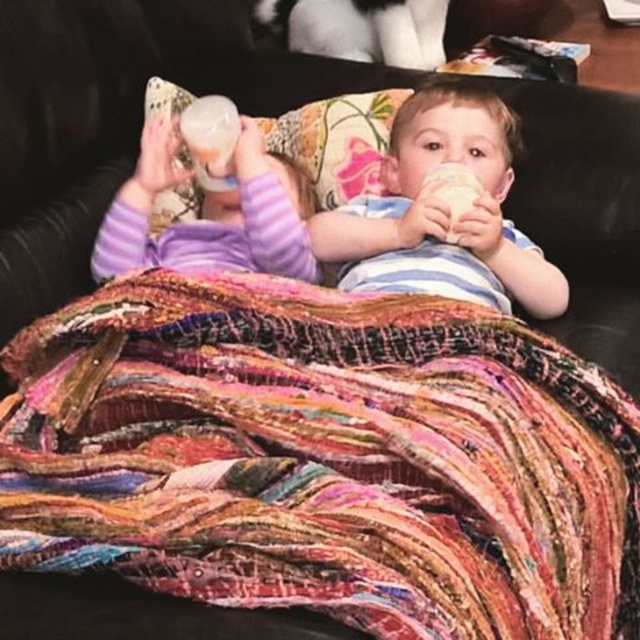
From the picture: You are a photographer setting up a shoot in this living room. You need to place a large tripod between the black leather couch at center and the purple fleece onesie at left. Based on their positions, which side of the tripod should face the couch?

The black leather couch at center is positioned on the right side of purple fleece onesie at left, so the tripod should be placed with its right side facing the couch.

You are a tailor measuring the distance between the multicolored woven fabric at center and the striped cotton shirt at center. The minimum distance required for your sewing machine to operate safely is 35 centimeters. Can you safely operate the sewing machine between them?

The multicolored woven fabric at center is 35.25 centimeters from the striped cotton shirt at center. Since 35.25 cm is greater than the 35 cm minimum requirement, the sewing machine can operate safely between them.

You are a photographer trying to capture a closeup of the black leather couch at center without the purple fleece onesie at left being visible. Is this possible given their positions?

The black leather couch at center is in front of the purple fleece onesie at left, so it is possible to take a closeup of the black leather couch at center without the purple fleece onesie at left being visible by focusing on the front part of the couch.